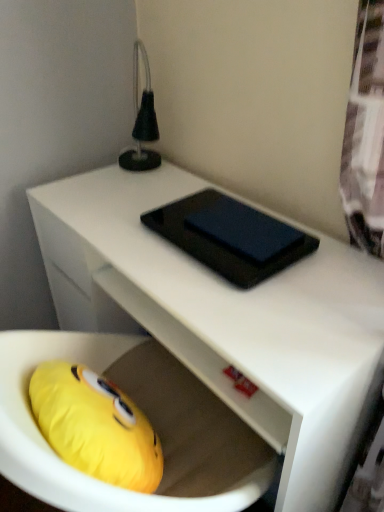
Locate an element on the screen. The height and width of the screenshot is (512, 384). free space above white matte desk at center (from a real-world perspective) is located at coordinates (186, 245).